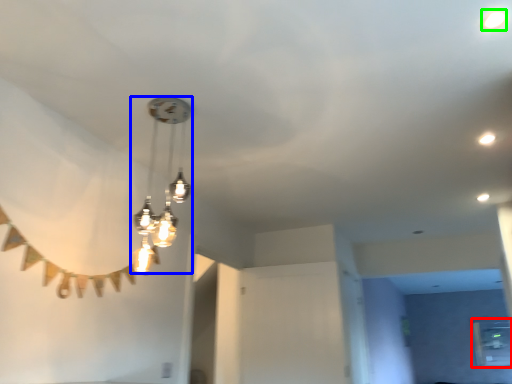
Question: Estimate the real-world distances between objects in this image. Which object is closer to window (highlighted by a red box), lamp (highlighted by a blue box) or droplight (highlighted by a green box)?

Choices:
 (A) lamp
 (B) droplight

Answer: (A)